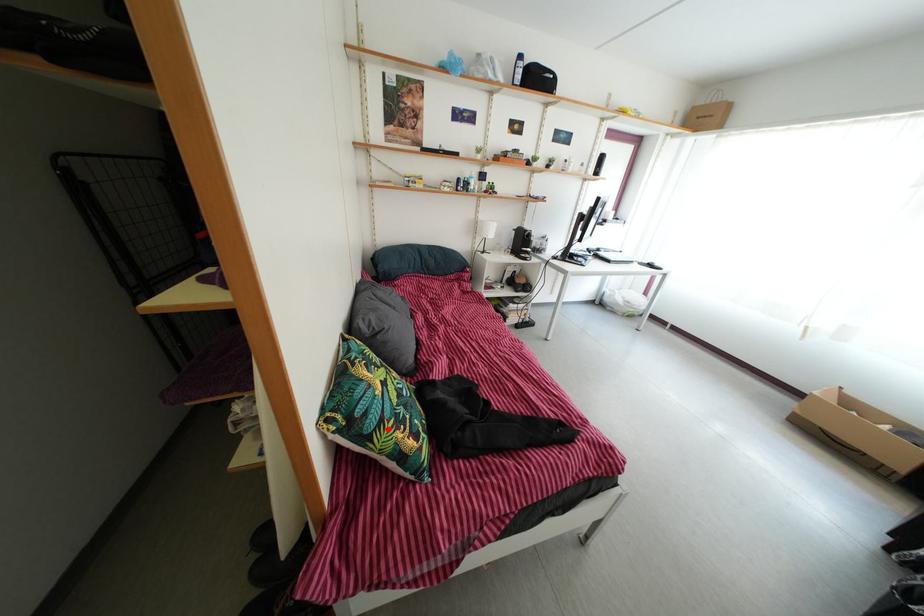
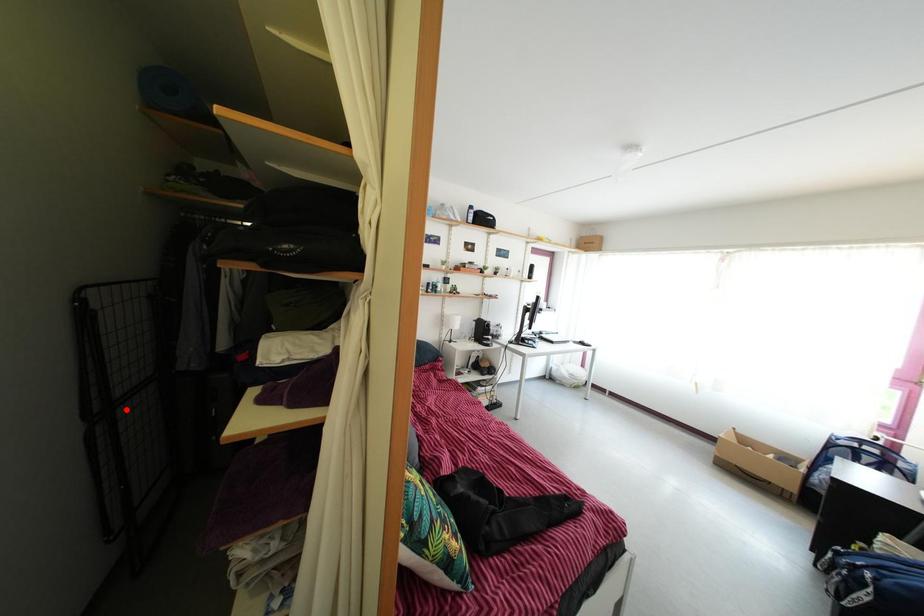
I am providing you with two images of the same scene from different viewpoints. A red point is marked on the first image and another point is marked on the second image. Do the highlighted points in image1 and image2 indicate the same real-world spot?

No